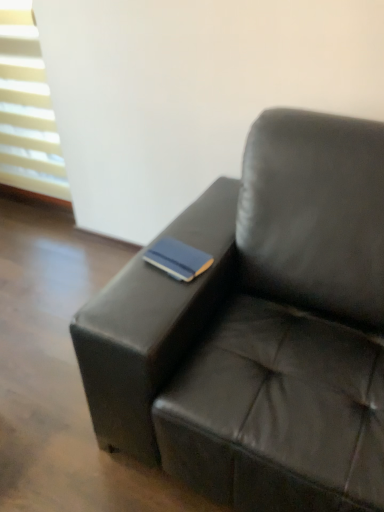
Question: Looking at their shapes, would you say blue matte book at center is wider or thinner than white plastic blinds at upper left?

Choices:
 (A) thin
 (B) wide

Answer: (A)

Question: From the image's perspective, relative to white plastic blinds at upper left, is blue matte book at center above or below?

Choices:
 (A) below
 (B) above

Answer: (A)

Question: Based on their relative distances, which object is nearer to the black leather couch at center?

Choices:
 (A) blue matte book at center
 (B) white plastic blinds at upper left

Answer: (A)

Question: Estimate the real-world distances between objects in this image. Which object is farther from the blue matte book at center?

Choices:
 (A) black leather couch at center
 (B) white plastic blinds at upper left

Answer: (B)